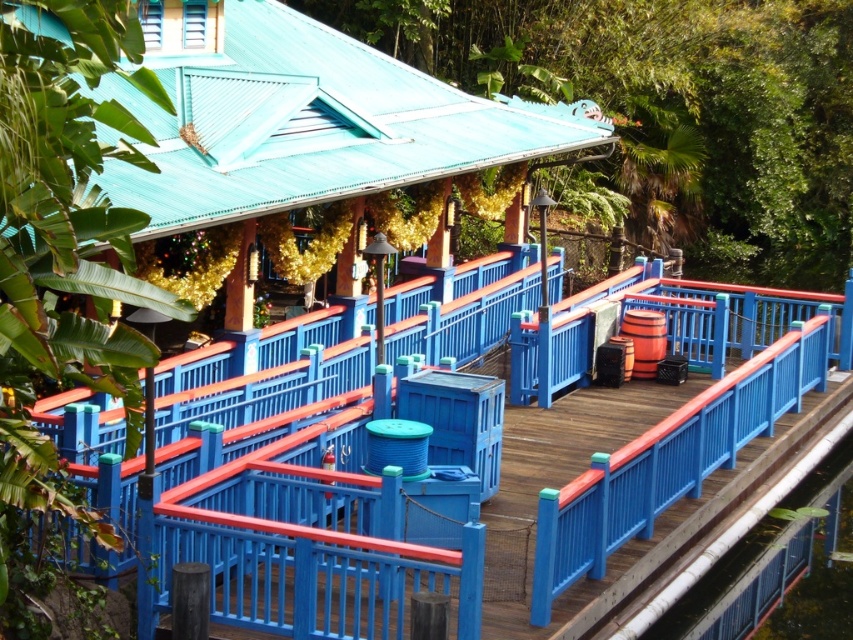
Which is more to the right, blue painted wood deck at center or blue painted wood at right?

blue painted wood at right

Does blue painted wood deck at center come behind blue painted wood at right?

No.

Does point (260, 561) come in front of point (715, 458)?

Yes, it is.

Locate an element on the screen. Image resolution: width=853 pixels, height=640 pixels. blue painted wood deck at center is located at coordinates (267, 499).

Who is more forward, [653,456] or [834,602]?

Point [653,456] is in front.

Can you confirm if blue painted wood at right is thinner than clear plastic water at lower right?

No.

Between point (664, 435) and point (799, 490), which one is positioned in front?

Point (664, 435) is more forward.

At what (x,y) coordinates should I click in order to perform the action: click on blue painted wood at right. Please return your answer as a coordinate pair (x, y). Looking at the image, I should click on (669, 461).

Can you confirm if blue painted wood deck at center is bigger than clear plastic water at lower right?

Correct, blue painted wood deck at center is larger in size than clear plastic water at lower right.

Which is below, blue painted wood deck at center or clear plastic water at lower right?

clear plastic water at lower right is below.

Who is more distant from viewer, (717, 412) or (749, 563)?

The point (749, 563) is behind.

I want to click on blue painted wood deck at center, so click(267, 499).